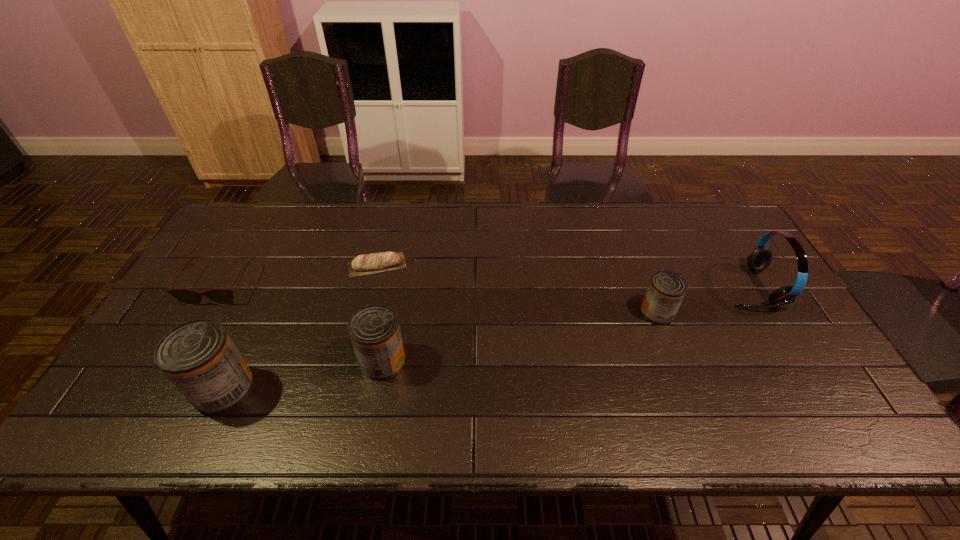
Find the location of a particular element. the fourth closest object relative to the fifth tallest object is located at coordinates (667, 289).

Choose which can is the second nearest neighbor to the spectacles. Please provide its 2D coordinates. Your answer should be formatted as a tuple, i.e. [(x, y)], where the tuple contains the x and y coordinates of a point satisfying the conditions above.

[(374, 330)]

Locate an element on the screen. The width and height of the screenshot is (960, 540). the closest can relative to the shortest object is located at coordinates (374, 330).

Locate an element on the screen. The width and height of the screenshot is (960, 540). vacant space that satisfies the following two spatial constraints: 1. at the front view of the third tallest object; 2. on the right side of the second shortest object is located at coordinates (177, 361).

Locate an element on the screen. The image size is (960, 540). vacant point that satisfies the following two spatial constraints: 1. at the front view of the fifth object from left to right; 2. on the right side of the fifth tallest object is located at coordinates (204, 313).

The height and width of the screenshot is (540, 960). I want to click on vacant space that satisfies the following two spatial constraints: 1. with the microphone attached to the side of the rightmost object; 2. on the front side of the second tallest can, so click(794, 361).

Identify the location of free space that satisfies the following two spatial constraints: 1. with the microphone attached to the side of the rightmost object; 2. on the front side of the tallest can. (810, 389).